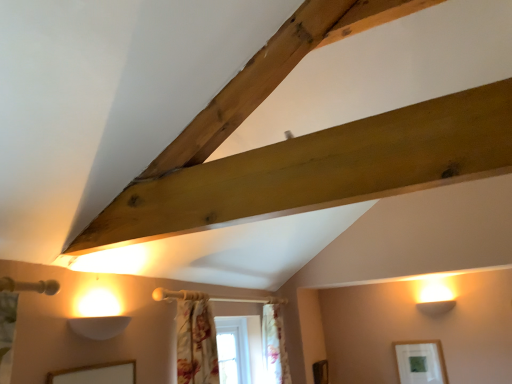
Image resolution: width=512 pixels, height=384 pixels. Identify the location of floral fabric curtain at lower center, placed as the 2th curtain when sorted from back to front. (196, 341).

The width and height of the screenshot is (512, 384). Describe the element at coordinates (274, 346) in the screenshot. I see `floral fabric curtain at center, the 2th curtain positioned from the front` at that location.

What do you see at coordinates (233, 350) in the screenshot?
I see `white painted wood window at center` at bounding box center [233, 350].

The image size is (512, 384). Find the location of `white painted wood window at center`. white painted wood window at center is located at coordinates point(233,350).

The height and width of the screenshot is (384, 512). I want to click on floral fabric curtain at lower center, placed as the 2th curtain when sorted from back to front, so (x=196, y=341).

Is matte white picture frame at lower right in front of or behind floral fabric curtain at center, the 2th curtain positioned from the front, in the image?

matte white picture frame at lower right is positioned farther from the viewer than floral fabric curtain at center, the 2th curtain positioned from the front.

In the scene shown: Is matte white picture frame at lower right taller than floral fabric curtain at center, the 2th curtain positioned from the front?

In fact, matte white picture frame at lower right may be shorter than floral fabric curtain at center, the 2th curtain positioned from the front.

From the image's perspective, which is above, floral fabric curtain at lower center, the 2th curtain in the right-to-left sequence, or floral fabric curtain at center, the 2th curtain positioned from the front?

floral fabric curtain at lower center, the 2th curtain in the right-to-left sequence, appears higher in the image.

Does floral fabric curtain at lower center, placed as the 2th curtain when sorted from back to front, have a greater height compared to floral fabric curtain at center, which is the 1th curtain in back-to-front order?

In fact, floral fabric curtain at lower center, placed as the 2th curtain when sorted from back to front, may be shorter than floral fabric curtain at center, which is the 1th curtain in back-to-front order.

Is floral fabric curtain at lower center, acting as the 1th curtain starting from the left, to the left or to the right of floral fabric curtain at center, which ranks as the 1th curtain in right-to-left order, in the image?

floral fabric curtain at lower center, acting as the 1th curtain starting from the left, is positioned on floral fabric curtain at center, which ranks as the 1th curtain in right-to-left order,'s left side.

Measure the distance from floral fabric curtain at lower center, placed as the 2th curtain when sorted from back to front, to floral fabric curtain at center, the 2th curtain positioned from the front.

They are 94.72 centimeters apart.

From a real-world perspective, which is physically above, white painted wood window at center or matte white picture frame at lower right?

white painted wood window at center.

How far apart are white painted wood window at center and matte white picture frame at lower right?

white painted wood window at center and matte white picture frame at lower right are 1.41 meters apart from each other.

Is white painted wood window at center next to matte white picture frame at lower right and touching it?

white painted wood window at center and matte white picture frame at lower right are clearly separated.

Which is less distant, (220, 325) or (441, 381)?

Clearly, point (220, 325) is closer to the camera than point (441, 381).

Is floral fabric curtain at lower center, which is the first curtain from front to back, positioned with its back to white painted wood window at center?

No, floral fabric curtain at lower center, which is the first curtain from front to back, is not facing away from white painted wood window at center.

Between floral fabric curtain at lower center, placed as the 2th curtain when sorted from back to front, and white painted wood window at center, which one has more height?

With more height is white painted wood window at center.

Does floral fabric curtain at lower center, the 2th curtain in the right-to-left sequence, have a greater width compared to white painted wood window at center?

Correct, the width of floral fabric curtain at lower center, the 2th curtain in the right-to-left sequence, exceeds that of white painted wood window at center.

From the image's perspective, between floral fabric curtain at lower center, placed as the 2th curtain when sorted from back to front, and white painted wood window at center, who is located below?

white painted wood window at center, from the image's perspective.

From the image's perspective, is matte white picture frame at lower right below white painted wood window at center?

Yes, from the image's perspective, matte white picture frame at lower right is beneath white painted wood window at center.

In the scene shown: From a real-world perspective, which is physically above, matte white picture frame at lower right or white painted wood window at center?

In real-world perspective, white painted wood window at center is above.

Is matte white picture frame at lower right in front of or behind white painted wood window at center in the image?

In the image, matte white picture frame at lower right appears behind white painted wood window at center.

Considering the relative sizes of matte white picture frame at lower right and white painted wood window at center in the image provided, is matte white picture frame at lower right taller than white painted wood window at center?

No.

The width and height of the screenshot is (512, 384). Find the location of `curtain in front of the floral fabric curtain at center, the second curtain when ordered from left to right`. curtain in front of the floral fabric curtain at center, the second curtain when ordered from left to right is located at coordinates pos(196,341).

Is floral fabric curtain at center, the second curtain when ordered from left to right, to the left or to the right of floral fabric curtain at lower center, which is the first curtain from front to back, in the image?

In the image, floral fabric curtain at center, the second curtain when ordered from left to right, appears on the right side of floral fabric curtain at lower center, which is the first curtain from front to back.

Which is correct: floral fabric curtain at center, which is the 1th curtain in back-to-front order, is inside floral fabric curtain at lower center, placed as the 2th curtain when sorted from back to front, or outside of it?

floral fabric curtain at center, which is the 1th curtain in back-to-front order, lies outside floral fabric curtain at lower center, placed as the 2th curtain when sorted from back to front.

Considering the points (273, 382) and (181, 316), which point is behind, point (273, 382) or point (181, 316)?

The point (273, 382) is farther.

From a real-world perspective, is floral fabric curtain at lower center, the 2th curtain in the right-to-left sequence, beneath matte white picture frame at lower right?

Actually, floral fabric curtain at lower center, the 2th curtain in the right-to-left sequence, is physically above matte white picture frame at lower right in the real world.

Looking at this image, is floral fabric curtain at lower center, the 2th curtain in the right-to-left sequence, positioned far away from matte white picture frame at lower right?

floral fabric curtain at lower center, the 2th curtain in the right-to-left sequence, is far away from matte white picture frame at lower right.

Looking at this image, which of these two, floral fabric curtain at lower center, acting as the 1th curtain starting from the left, or matte white picture frame at lower right, stands shorter?

matte white picture frame at lower right is shorter.

Does point (190, 312) come farther from viewer compared to point (431, 343)?

No.

The width and height of the screenshot is (512, 384). I want to click on curtain that is the 1st one above the matte white picture frame at lower right (from a real-world perspective), so click(x=274, y=346).

Locate an element on the screen. curtain below the floral fabric curtain at lower center, the 2th curtain in the right-to-left sequence (from the image's perspective) is located at coordinates (274, 346).

Based on their spatial positions, is white painted wood window at center or matte white picture frame at lower right further from floral fabric curtain at center, which ranks as the 1th curtain in right-to-left order?

matte white picture frame at lower right is further to floral fabric curtain at center, which ranks as the 1th curtain in right-to-left order.

Which object lies nearer to the anchor point floral fabric curtain at center, which ranks as the 1th curtain in right-to-left order, white painted wood window at center or floral fabric curtain at lower center, acting as the 1th curtain starting from the left?

white painted wood window at center is closer to floral fabric curtain at center, which ranks as the 1th curtain in right-to-left order.

Looking at the image, which one is located closer to floral fabric curtain at lower center, placed as the 2th curtain when sorted from back to front, floral fabric curtain at center, the second curtain when ordered from left to right, or matte white picture frame at lower right?

The object closer to floral fabric curtain at lower center, placed as the 2th curtain when sorted from back to front, is floral fabric curtain at center, the second curtain when ordered from left to right.

Considering their positions, is floral fabric curtain at lower center, placed as the 2th curtain when sorted from back to front, positioned further to white painted wood window at center than floral fabric curtain at center, which is the 1th curtain in back-to-front order?

floral fabric curtain at lower center, placed as the 2th curtain when sorted from back to front, is further to white painted wood window at center.

When comparing their distances from floral fabric curtain at center, the second curtain when ordered from left to right, does matte white picture frame at lower right or floral fabric curtain at lower center, placed as the 2th curtain when sorted from back to front, seem closer?

The object closer to floral fabric curtain at center, the second curtain when ordered from left to right, is floral fabric curtain at lower center, placed as the 2th curtain when sorted from back to front.

Looking at the image, which one is located closer to white painted wood window at center, matte white picture frame at lower right or floral fabric curtain at lower center, which is the first curtain from front to back?

floral fabric curtain at lower center, which is the first curtain from front to back, is closer to white painted wood window at center.

Considering their positions, is white painted wood window at center positioned closer to floral fabric curtain at lower center, which is the first curtain from front to back, than matte white picture frame at lower right?

The object closer to floral fabric curtain at lower center, which is the first curtain from front to back, is white painted wood window at center.

Looking at the image, which one is located further to floral fabric curtain at lower center, the 2th curtain in the right-to-left sequence, matte white picture frame at lower right or white painted wood window at center?

The object further to floral fabric curtain at lower center, the 2th curtain in the right-to-left sequence, is matte white picture frame at lower right.

Locate an element on the screen. window between floral fabric curtain at lower center, which is the first curtain from front to back, and matte white picture frame at lower right from left to right is located at coordinates (233, 350).

Find the location of a particular element. Image resolution: width=512 pixels, height=384 pixels. curtain between white painted wood window at center and matte white picture frame at lower right from left to right is located at coordinates (274, 346).

You are a GUI agent. You are given a task and a screenshot of the screen. Output one action in this format:
    pyautogui.click(x=<x>, y=<y>)
    Task: Click on the curtain located between floral fabric curtain at lower center, placed as the 2th curtain when sorted from back to front, and matte white picture frame at lower right in the left-right direction
    The height and width of the screenshot is (384, 512).
    Given the screenshot: What is the action you would take?
    pyautogui.click(x=274, y=346)

What are the coordinates of `window between floral fabric curtain at lower center, placed as the 2th curtain when sorted from back to front, and floral fabric curtain at center, which is the 1th curtain in back-to-front order, along the z-axis` in the screenshot? It's located at point(233,350).